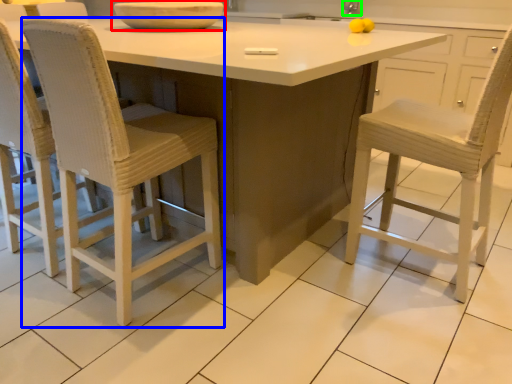
Question: Based on their relative distances, which object is nearer to bowl (highlighted by a red box)? Choose from chair (highlighted by a blue box) and faucet (highlighted by a green box).

Choices:
 (A) chair
 (B) faucet

Answer: (A)